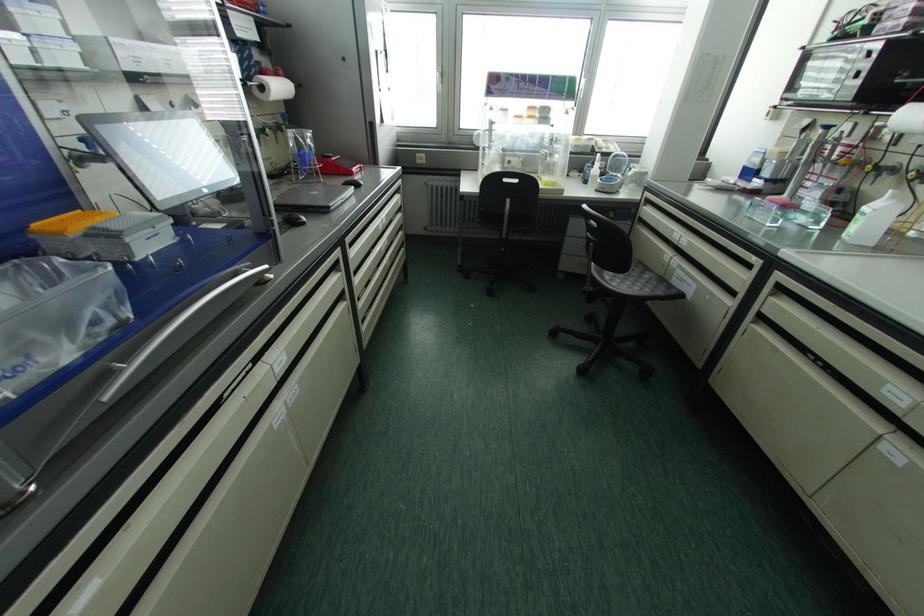
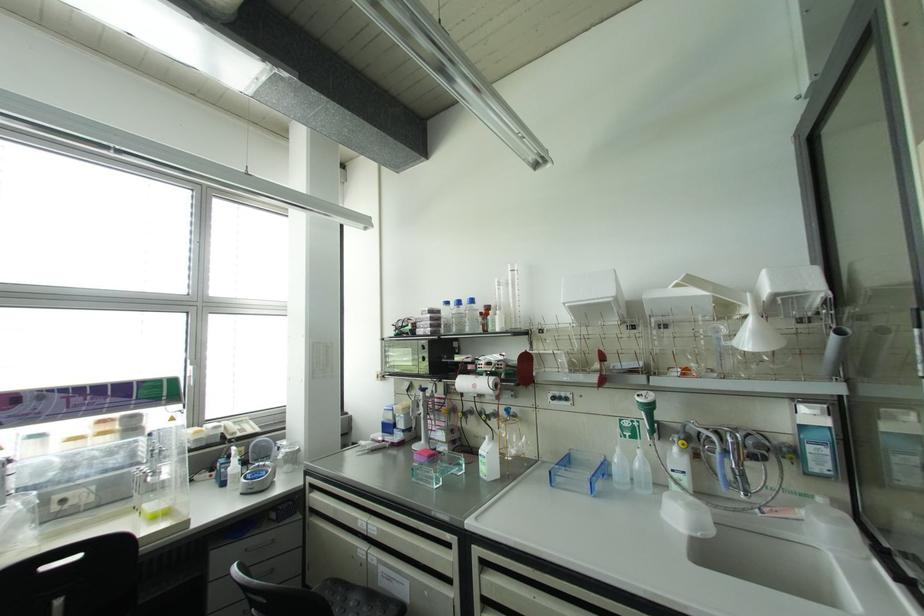
Find the pixel in the second image that matches point (748, 174) in the first image.

(387, 427)